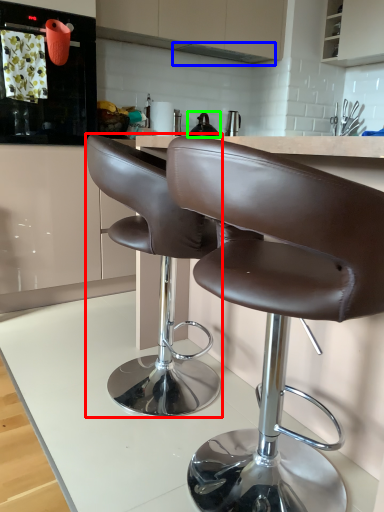
Question: Which object is the closest to the chair (highlighted by a red box)? Choose among these: exhaust hood (highlighted by a blue box) or tea pot (highlighted by a green box).

Choices:
 (A) exhaust hood
 (B) tea pot

Answer: (B)